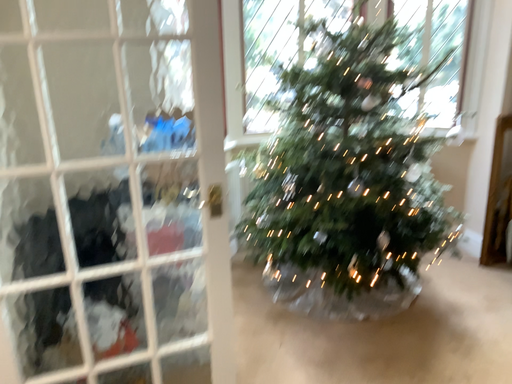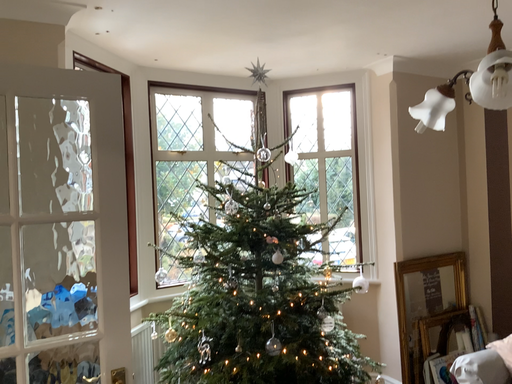
Question: Which way did the camera rotate in the video?

Choices:
 (A) rotated upward
 (B) rotated downward

Answer: (A)